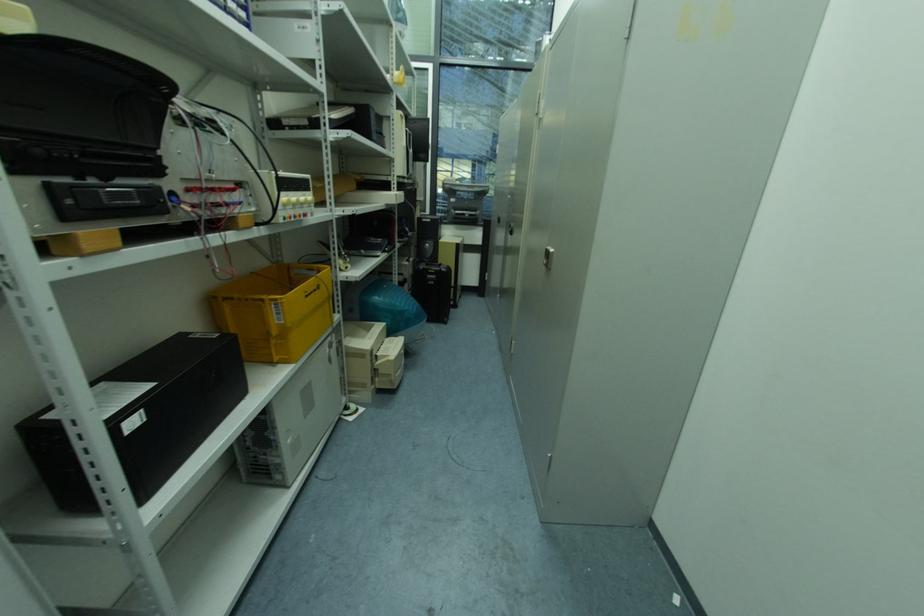
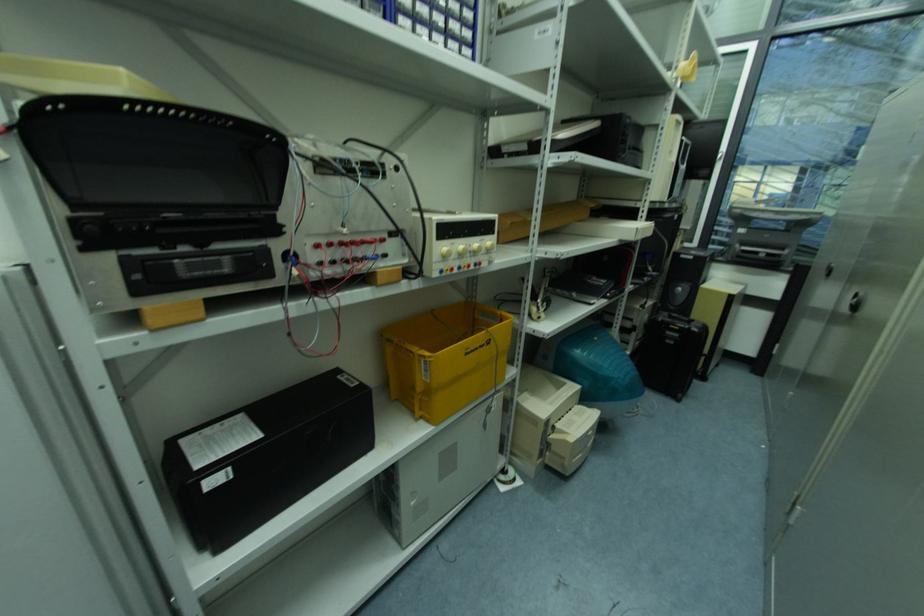
Question: Based on the continuous images, in which direction is the camera rotating? Reply with the corresponding letter.

Choices:
 (A) Left
 (B) Right
 (C) Up
 (D) Down

Answer: (A)